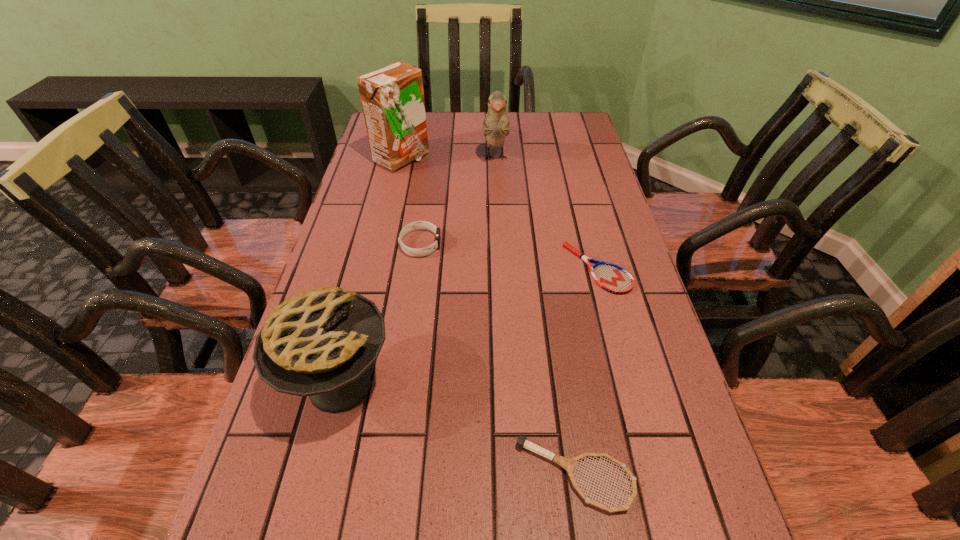
Where is `vacant space at the right edge of the desktop`? The height and width of the screenshot is (540, 960). vacant space at the right edge of the desktop is located at coordinates (583, 231).

Where is `free space at the far right corner of the desktop`? This screenshot has width=960, height=540. free space at the far right corner of the desktop is located at coordinates (582, 130).

Where is `empty space that is in between the carton and the nearer tennis racket`? empty space that is in between the carton and the nearer tennis racket is located at coordinates (489, 317).

This screenshot has height=540, width=960. I want to click on vacant area that lies between the fourth shortest object and the second tallest object, so click(418, 272).

This screenshot has height=540, width=960. I want to click on vacant space that's between the taller tennis racket and the shorter tennis racket, so tap(587, 372).

Identify the location of free space between the shortest object and the pie. (468, 327).

Where is `free spot between the shortest object and the carton`? Image resolution: width=960 pixels, height=540 pixels. free spot between the shortest object and the carton is located at coordinates 499,214.

Identify the location of vacant area that lies between the fifth tallest object and the wristband. This screenshot has height=540, width=960. (498, 359).

This screenshot has width=960, height=540. In order to click on empty space between the wristband and the shortest object in this screenshot , I will do `click(509, 256)`.

Locate an element on the screen. The image size is (960, 540). object that is the nearest to the second shortest object is located at coordinates (319, 343).